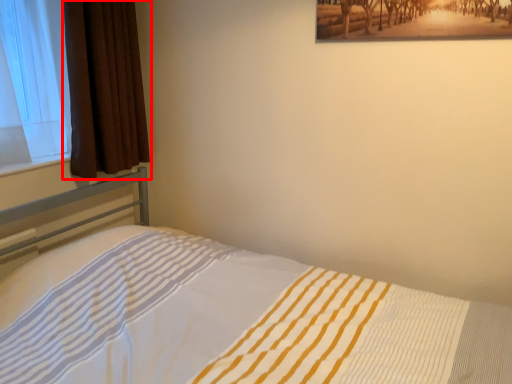
Question: Where is curtain (annotated by the red box) located in relation to bed in the image?

Choices:
 (A) left
 (B) right

Answer: (A)